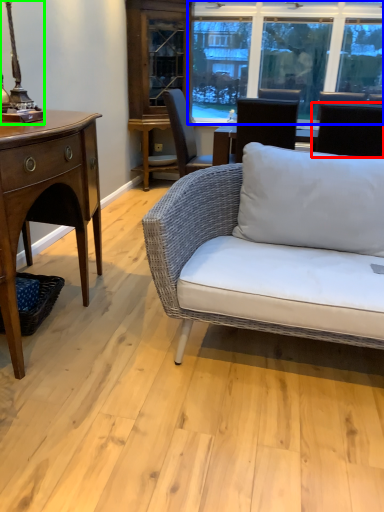
Question: Considering the real-world distances, which object is closest to chair (highlighted by a red box)? window (highlighted by a blue box) or table lamp (highlighted by a green box).

Choices:
 (A) window
 (B) table lamp

Answer: (B)